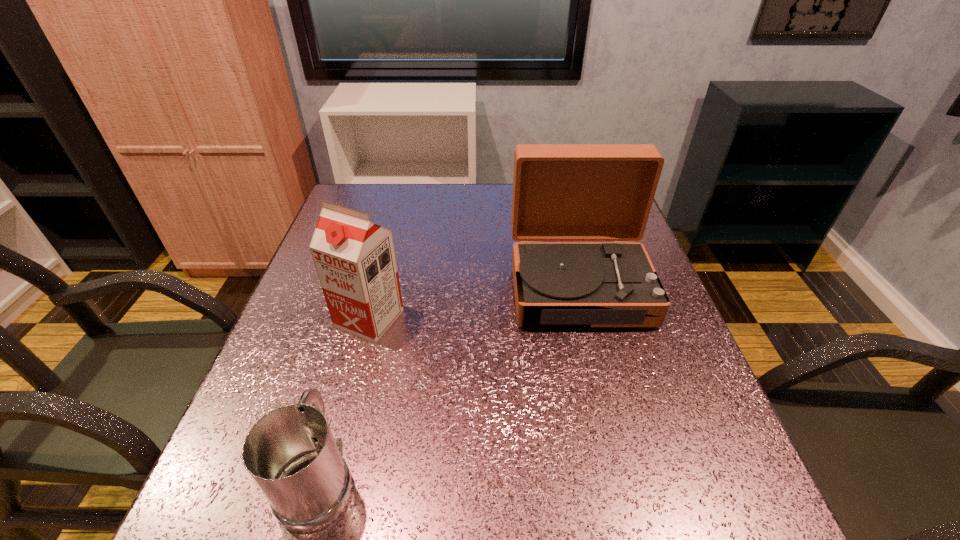
Find the location of a particular element. This screenshot has height=540, width=960. the rightmost object is located at coordinates (561, 192).

Identify the location of soya milk. The width and height of the screenshot is (960, 540). (355, 260).

Where is `the nearest object`? The width and height of the screenshot is (960, 540). the nearest object is located at coordinates pos(290,453).

Find the location of a particular element. The width and height of the screenshot is (960, 540). the shortest object is located at coordinates (290, 453).

This screenshot has height=540, width=960. Identify the location of vacant space located 0.210m on the face of the rightmost object. (612, 421).

I want to click on vacant space located on the back of the soya milk, so coord(387,251).

This screenshot has height=540, width=960. I want to click on vacant space positioned 0.350m on the side of the nearest object with the handle, so click(371, 292).

Locate an element on the screen. vacant space located on the side of the nearest object with the handle is located at coordinates (354, 348).

Identify the location of vacant space located 0.280m on the side of the nearest object with the handle. [x=365, y=313].

Where is `object at the near edge`? The height and width of the screenshot is (540, 960). object at the near edge is located at coordinates (290, 453).